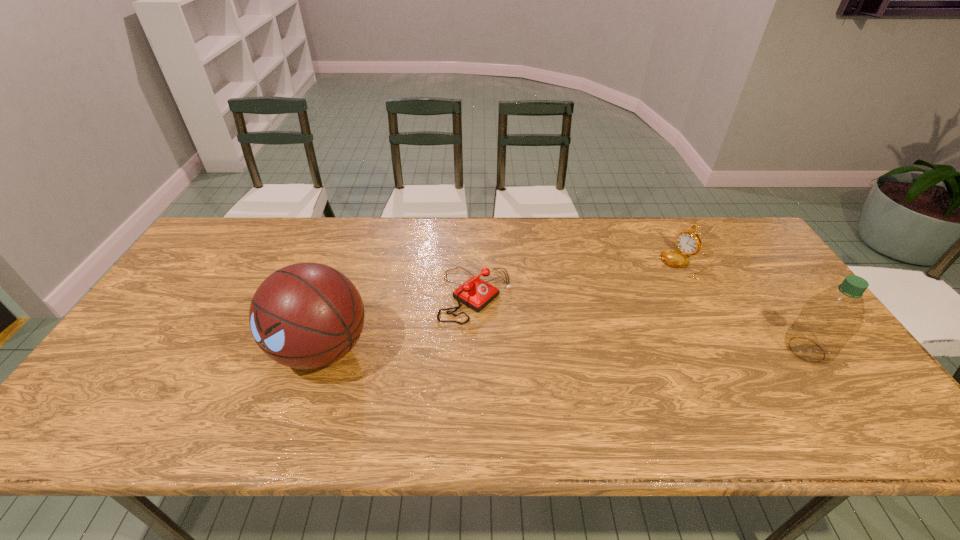
What are the coordinates of `vacant space at the far left corner of the desktop` in the screenshot? It's located at (239, 230).

Identify the location of free space at the far right corner of the desktop. This screenshot has width=960, height=540. (708, 243).

Identify the location of free spot at the near right corner of the desktop. Image resolution: width=960 pixels, height=540 pixels. (856, 392).

This screenshot has height=540, width=960. Find the location of `free space between the shortest object and the water bottle`. free space between the shortest object and the water bottle is located at coordinates (641, 322).

The height and width of the screenshot is (540, 960). Identify the location of free space that is in between the telephone and the leftmost object. (398, 322).

Where is `free space between the basketball and the shortest object`? This screenshot has width=960, height=540. free space between the basketball and the shortest object is located at coordinates (398, 322).

Where is `empty space that is in between the second shortest object and the leftmost object`? This screenshot has width=960, height=540. empty space that is in between the second shortest object and the leftmost object is located at coordinates (503, 306).

What are the coordinates of `vacant space in between the basketball and the second shortest object` in the screenshot? It's located at (503, 306).

The image size is (960, 540). Identify the location of free point between the third object from right to left and the basketball. (398, 322).

The width and height of the screenshot is (960, 540). In order to click on vacant space that's between the telephone and the pocket watch in this screenshot , I will do `click(581, 279)`.